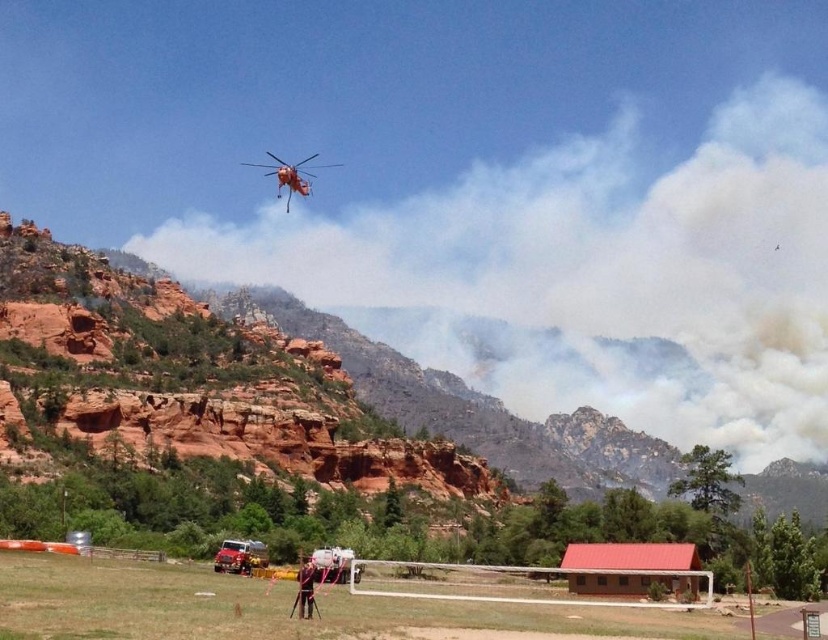
Is orange matte helicopter at upper center further to the viewer compared to dark brown leather jacket at lower center?

Yes, it is behind dark brown leather jacket at lower center.

Describe the element at coordinates (291, 176) in the screenshot. I see `orange matte helicopter at upper center` at that location.

Find the location of a particular element. This screenshot has height=640, width=828. orange matte helicopter at upper center is located at coordinates (291, 176).